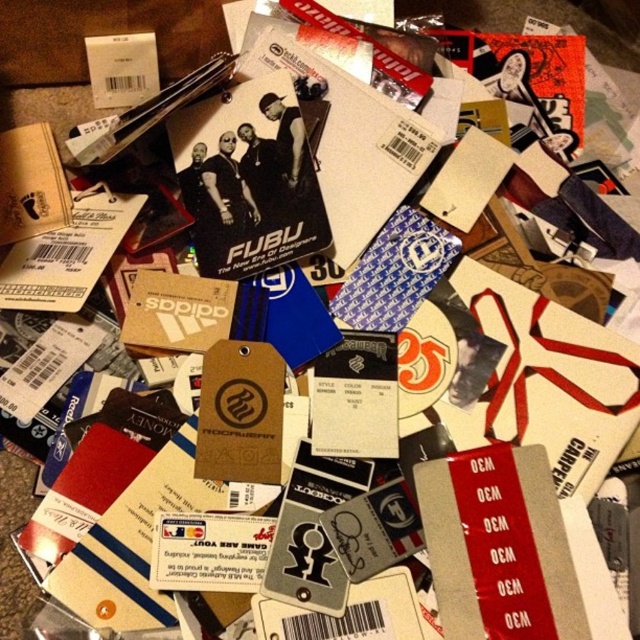
Question: Is matte black card at center positioned before brown cardboard at upper left?

Choices:
 (A) yes
 (B) no

Answer: (A)

Question: Which object is closer to the camera taking this photo?

Choices:
 (A) brown cardboard at upper left
 (B) matte black card at center

Answer: (B)

Question: Does matte black card at center have a larger size compared to brown cardboard at upper left?

Choices:
 (A) yes
 (B) no

Answer: (A)

Question: Is matte black card at center closer to the viewer compared to brown cardboard at upper left?

Choices:
 (A) no
 (B) yes

Answer: (B)

Question: Which point is farther from the camera taking this photo?

Choices:
 (A) (36, 172)
 (B) (218, 221)

Answer: (A)

Question: Which point appears farthest from the camera in this image?

Choices:
 (A) (33, 218)
 (B) (260, 141)

Answer: (B)